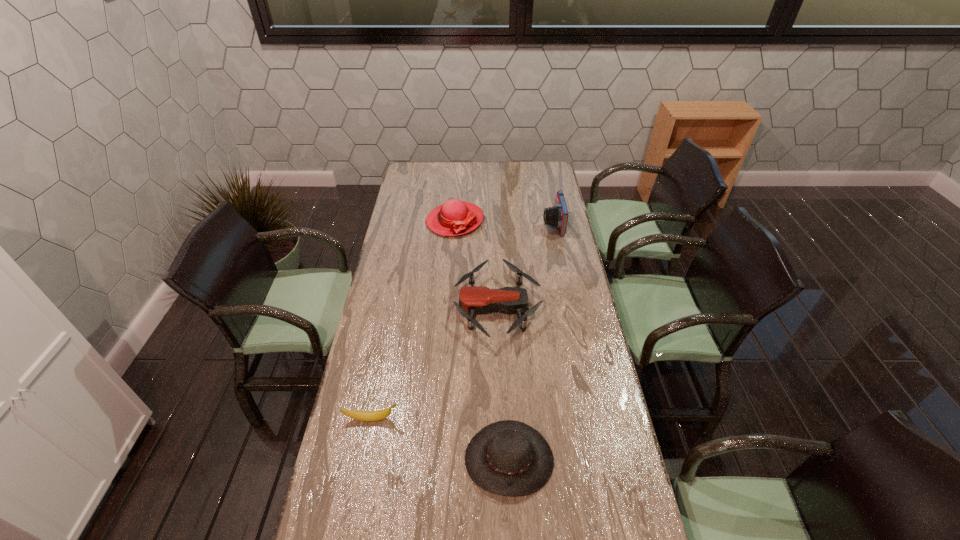
Where is `free point located 0.050m at the front of the fourth shortest object with a bow`? This screenshot has height=540, width=960. free point located 0.050m at the front of the fourth shortest object with a bow is located at coordinates (453, 246).

This screenshot has height=540, width=960. What are the coordinates of `vacant point located on the front-facing side of the drone` in the screenshot? It's located at (375, 308).

Identify the location of free space located 0.170m on the front-facing side of the drone. (411, 308).

Locate an element on the screen. The height and width of the screenshot is (540, 960). free region located on the front-facing side of the drone is located at coordinates (426, 308).

This screenshot has width=960, height=540. In order to click on free space located 0.370m at the stem of the fourth farthest object in this screenshot , I will do `click(517, 418)`.

Locate an element on the screen. hat that is at the left edge is located at coordinates (454, 217).

At what (x,y) coordinates should I click in order to perform the action: click on banana located at the left edge. Please return your answer as a coordinate pair (x, y). Looking at the image, I should click on (378, 415).

The height and width of the screenshot is (540, 960). I want to click on object at the right edge, so click(557, 216).

In the image, there is a desktop. Where is `vacant space at the far edge`? The image size is (960, 540). vacant space at the far edge is located at coordinates (447, 173).

In the image, there is a desktop. Where is `free region at the left edge`? free region at the left edge is located at coordinates (412, 246).